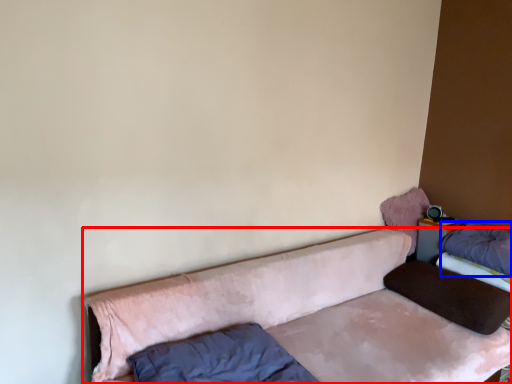
Question: Among these objects, which one is farthest to the camera, studio couch (highlighted by a red box) or pillow (highlighted by a blue box)?

Choices:
 (A) studio couch
 (B) pillow

Answer: (B)